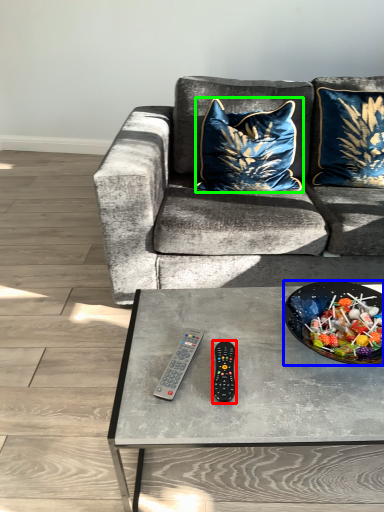
Question: Based on their relative distances, which object is farther from remote (highlighted by a red box)? Choose from bowl (highlighted by a blue box) and pillow (highlighted by a green box).

Choices:
 (A) bowl
 (B) pillow

Answer: (B)